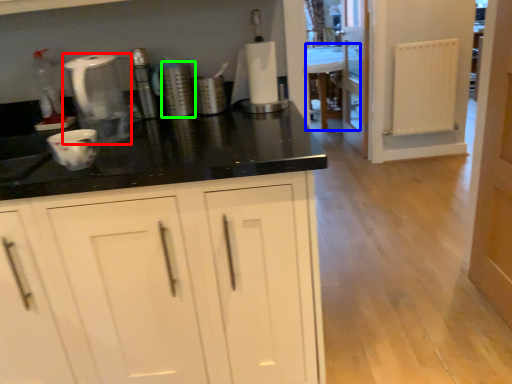
Question: Which object is the farthest from home appliance (highlighted by a red box)? Choose among these: vanity (highlighted by a blue box) or appliance (highlighted by a green box).

Choices:
 (A) vanity
 (B) appliance

Answer: (A)